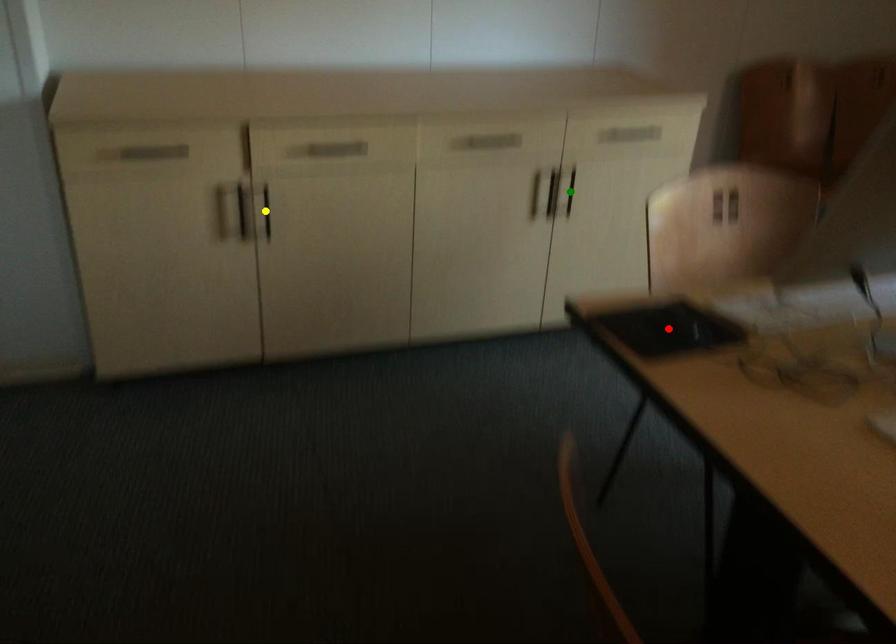
Order these from nearest to farthest:
1. yellow point
2. red point
3. green point

red point, yellow point, green point